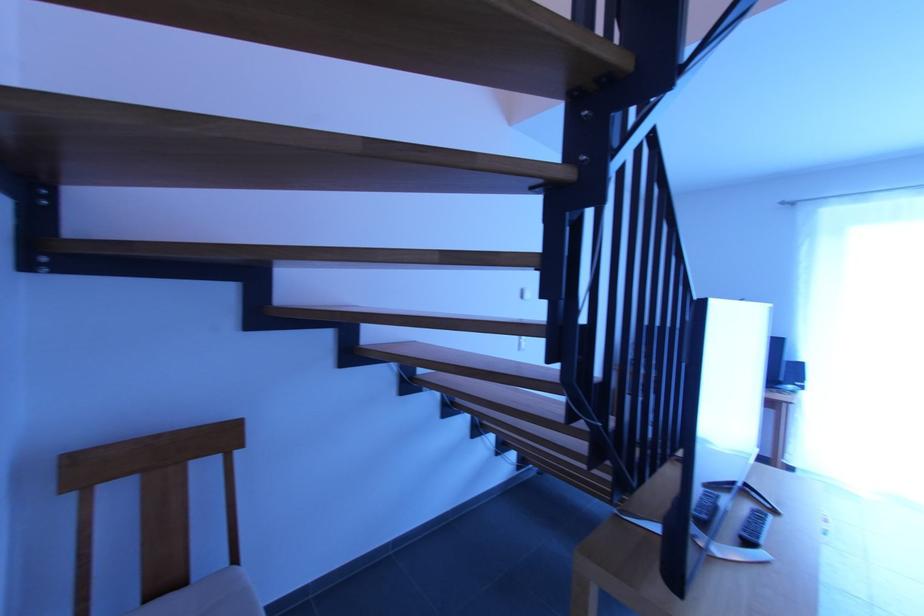
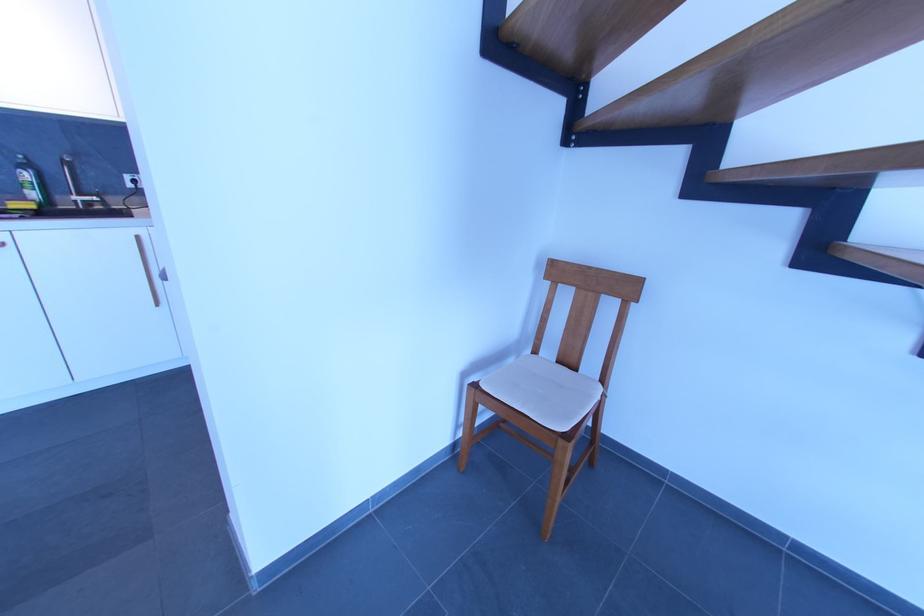
Consider the image. How did the camera likely rotate?

The camera's rotation is toward left-down.